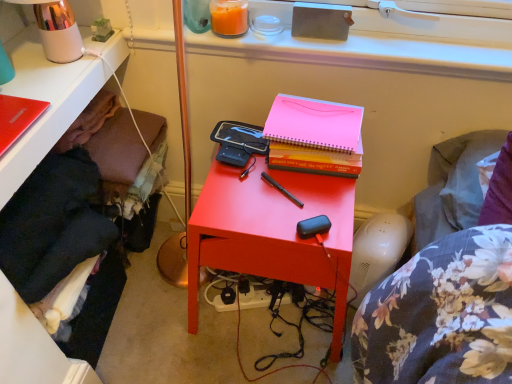
Question: In the image, is orange wax candle at upper center positioned in front of or behind matte red notebook at upper left?

Choices:
 (A) behind
 (B) front

Answer: (A)

Question: Would you say orange wax candle at upper center is inside or outside matte red notebook at upper left?

Choices:
 (A) inside
 (B) outside

Answer: (B)

Question: Which object is positioned closest to the black fabric at lower left?

Choices:
 (A) metallic pink table lamp at upper left
 (B) orange wax candle at upper center
 (C) hardcover book at center
 (D) matte red notebook at upper left
 (E) matte red nightstand at center

Answer: (D)

Question: Estimate the real-world distances between objects in this image. Which object is closer to the black fabric at lower left?

Choices:
 (A) orange wax candle at upper center
 (B) metallic pink table lamp at upper left
 (C) matte red nightstand at center
 (D) hardcover book at center
 (E) matte red notebook at upper left

Answer: (E)